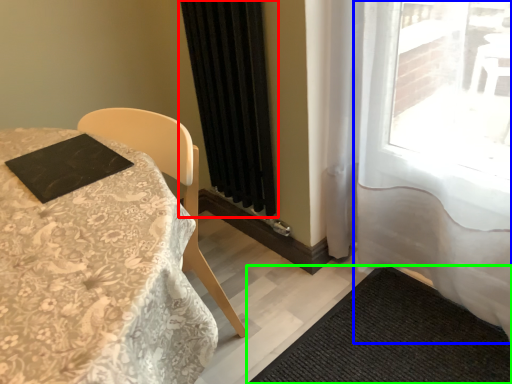
Question: Considering the real-world distances, which object is farthest from curtain (highlighted by a red box)? curtain (highlighted by a blue box) or doormat (highlighted by a green box)?

Choices:
 (A) curtain
 (B) doormat

Answer: (B)